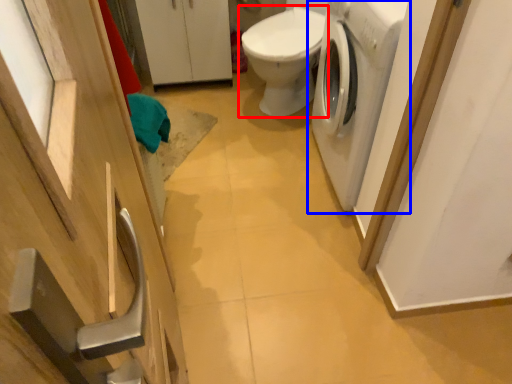
Question: Which point is closer to the camera, toilet (highlighted by a red box) or washing machine (highlighted by a blue box)?

Choices:
 (A) toilet
 (B) washing machine

Answer: (B)